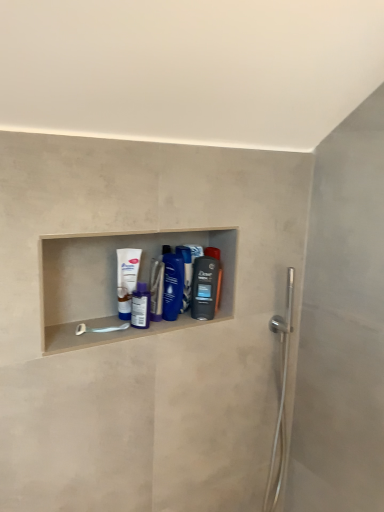
Question: In which direction should I rotate to look at blue glossy bottle at center, marked as the third mouthwash in a left-to-right arrangement?

Choices:
 (A) right
 (B) left

Answer: (B)

Question: Would you say purple glossy mouthwash at center, which is the fourth mouthwash from right to left, contains blue glossy shampoo bottle at center?

Choices:
 (A) yes
 (B) no

Answer: (B)

Question: Does purple glossy mouthwash at center, marked as the 2th mouthwash in a left-to-right arrangement, have a smaller size compared to blue glossy shampoo bottle at center?

Choices:
 (A) yes
 (B) no

Answer: (B)

Question: Is purple glossy mouthwash at center, marked as the 2th mouthwash in a left-to-right arrangement, shorter than blue glossy shampoo bottle at center?

Choices:
 (A) no
 (B) yes

Answer: (B)

Question: Are purple glossy mouthwash at center, which is the fourth mouthwash from right to left, and blue glossy shampoo bottle at center far apart?

Choices:
 (A) yes
 (B) no

Answer: (B)

Question: Is purple glossy mouthwash at center, marked as the 2th mouthwash in a left-to-right arrangement, further to camera compared to blue glossy shampoo bottle at center?

Choices:
 (A) no
 (B) yes

Answer: (A)

Question: Is purple glossy mouthwash at center, which is the fourth mouthwash from right to left, in front of blue glossy shampoo bottle at center?

Choices:
 (A) no
 (B) yes

Answer: (B)

Question: Can you confirm if blue glossy bottle at center, positioned as the 3th mouthwash in right-to-left order, is bigger than white glossy tube at center, the first mouthwash in the left-to-right sequence?

Choices:
 (A) no
 (B) yes

Answer: (A)

Question: Considering the relative sizes of blue glossy bottle at center, positioned as the 3th mouthwash in right-to-left order, and white glossy tube at center, acting as the fifth mouthwash starting from the right, in the image provided, is blue glossy bottle at center, positioned as the 3th mouthwash in right-to-left order, taller than white glossy tube at center, acting as the fifth mouthwash starting from the right,?

Choices:
 (A) no
 (B) yes

Answer: (A)

Question: Is blue glossy bottle at center, marked as the third mouthwash in a left-to-right arrangement, looking in the opposite direction of white glossy tube at center, acting as the fifth mouthwash starting from the right?

Choices:
 (A) yes
 (B) no

Answer: (B)

Question: Is the depth of blue glossy bottle at center, marked as the third mouthwash in a left-to-right arrangement, greater than that of white glossy tube at center, acting as the fifth mouthwash starting from the right?

Choices:
 (A) no
 (B) yes

Answer: (B)

Question: Is blue glossy bottle at center, positioned as the 3th mouthwash in right-to-left order, located outside white glossy tube at center, acting as the fifth mouthwash starting from the right?

Choices:
 (A) no
 (B) yes

Answer: (B)

Question: Can you confirm if blue glossy bottle at center, marked as the third mouthwash in a left-to-right arrangement, is wider than white glossy tube at center, the first mouthwash in the left-to-right sequence?

Choices:
 (A) no
 (B) yes

Answer: (B)

Question: From the image's perspective, does translucent plastic mouthwash at center, the 1th mouthwash viewed from the right, appear lower than purple glossy mouthwash at center, marked as the 2th mouthwash in a left-to-right arrangement?

Choices:
 (A) yes
 (B) no

Answer: (B)